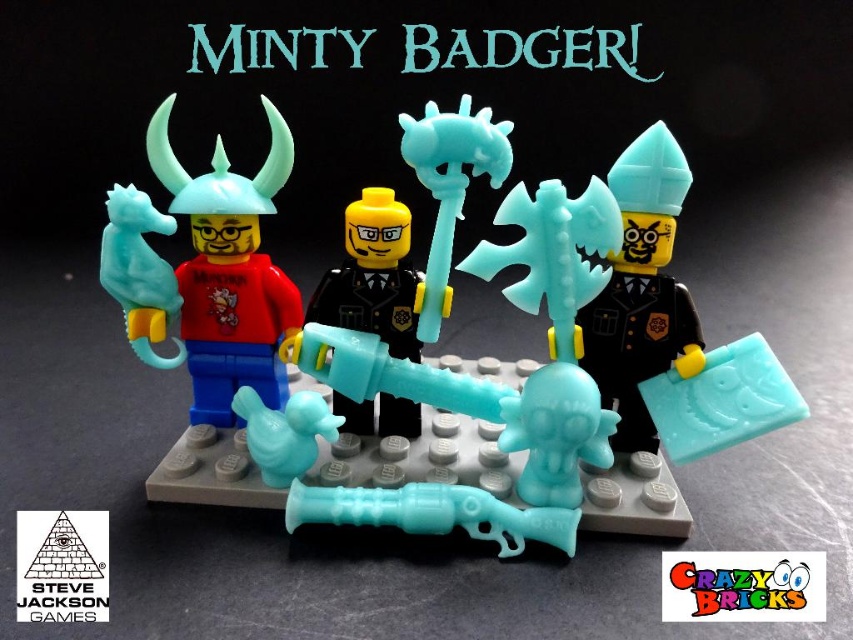
You are holding a camera and want to take a photo of the matte plastic minifigure at left. The camera has a minimum focus distance of 1 meter. Can you take a clear photo without moving the camera or the minifigure?

The matte plastic minifigure at left and camera are 91.07 centimeters apart, which is less than 1 meter. Therefore, the camera cannot focus clearly on the matte plastic minifigure at left without moving either the camera or the minifigure.

You are a new LEGO builder examining the set. You need to place the matte plastic axe at center and the matte plastic minifigure at left in a specific order. Which object is positioned to the right of the other?

The matte plastic axe at center is to the right of the matte plastic minifigure at left.

From the picture: What object is located at the coordinates point (474, 401) in the image?

The point at (474, 401) indicates the matte plastic axe at center.